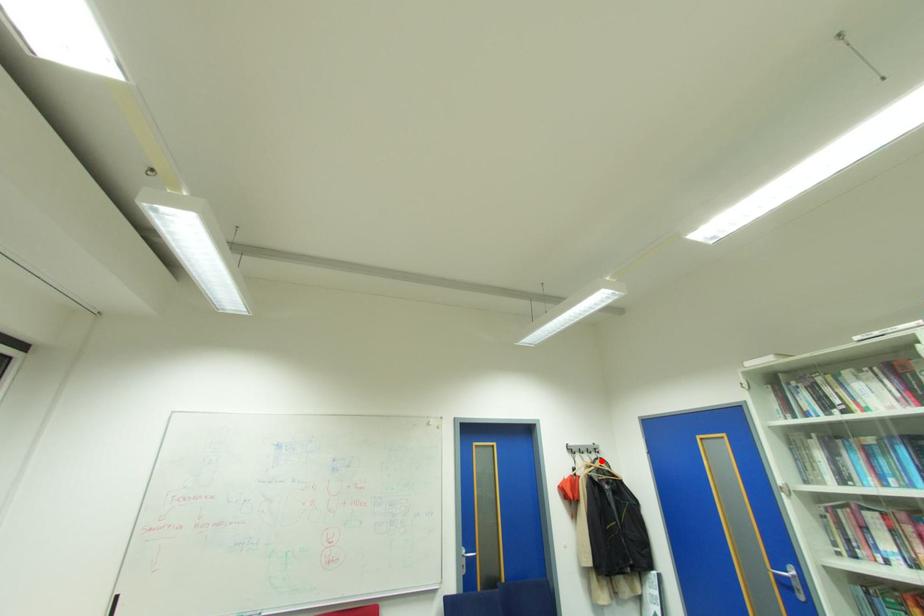
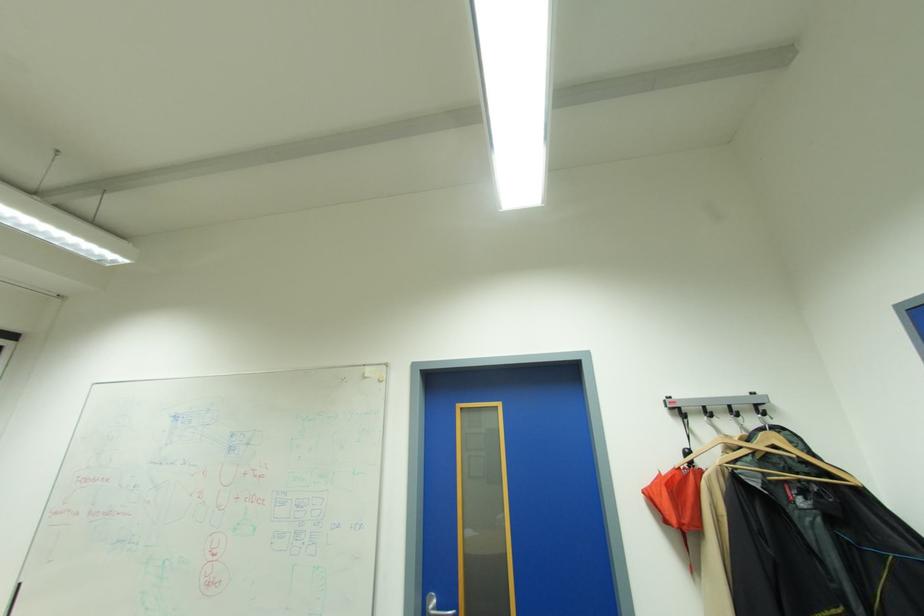
The point at the highlighted location is marked in the first image. Where is the corresponding point in the second image?

(764, 434)